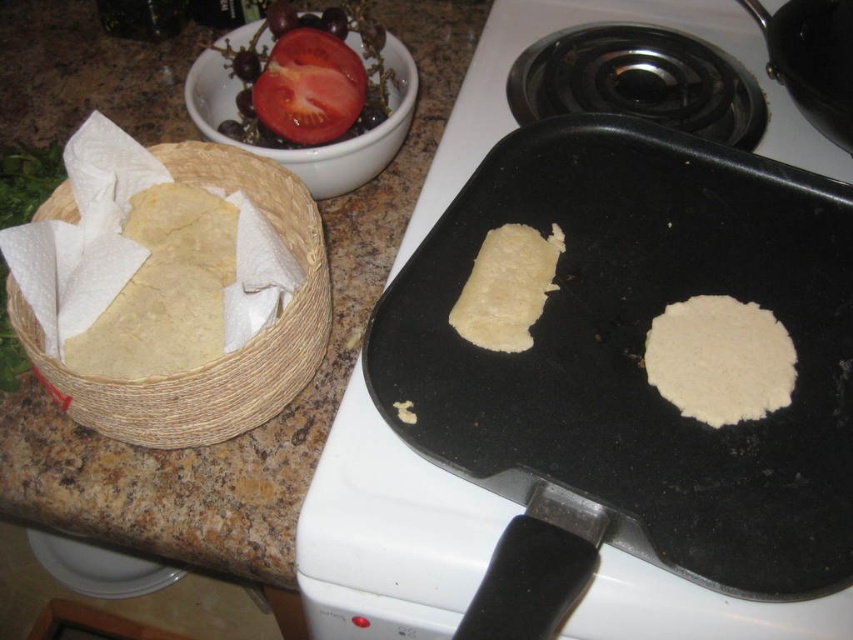
Question: Can you confirm if white matte pancake at center is positioned to the right of white matte tortilla at center?

Choices:
 (A) yes
 (B) no

Answer: (A)

Question: Can you confirm if woven straw basket at left is positioned below white matte pancake at center?

Choices:
 (A) no
 (B) yes

Answer: (A)

Question: Which object is positioned closest to the white matte tortilla at center?

Choices:
 (A) woven straw basket at left
 (B) red matte tomato at upper left

Answer: (A)

Question: Estimate the real-world distances between objects in this image. Which object is closer to the white matte tortilla at center?

Choices:
 (A) white matte pancake at center
 (B) woven straw basket at left
 (C) matte black griddle at center
 (D) red matte tomato at upper left

Answer: (C)

Question: Is woven straw basket at left to the right of red matte tomato at upper left from the viewer's perspective?

Choices:
 (A) yes
 (B) no

Answer: (B)

Question: Which point appears closest to the camera in this image?

Choices:
 (A) (109, 406)
 (B) (467, 205)
 (C) (715, 326)
 (D) (343, 72)

Answer: (A)